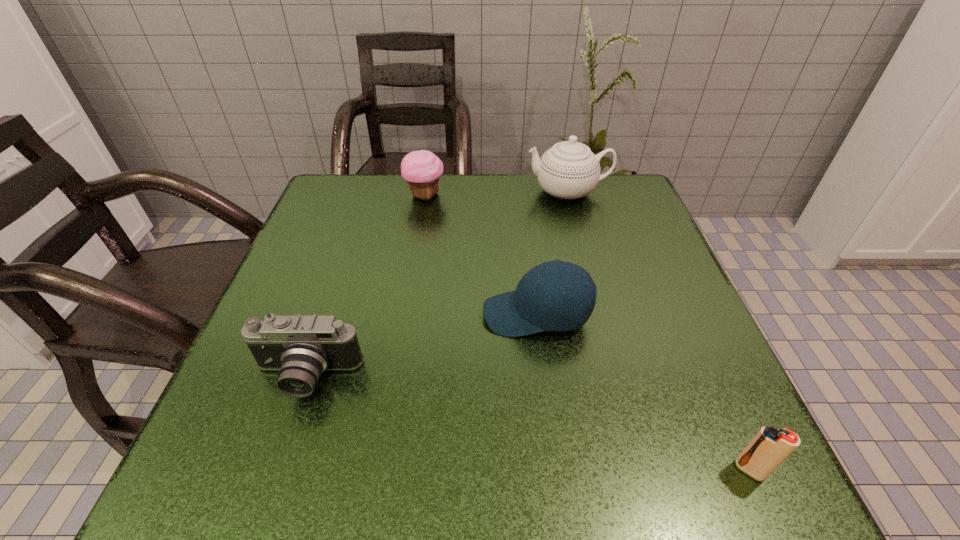
The height and width of the screenshot is (540, 960). Identify the location of chinaware at the right edge. (569, 170).

This screenshot has height=540, width=960. I want to click on igniter that is at the right edge, so click(770, 447).

You are a GUI agent. You are given a task and a screenshot of the screen. Output one action in this format:
    pyautogui.click(x=<x>, y=<y>)
    Task: Click on the object at the far right corner
    
    Given the screenshot: What is the action you would take?
    pyautogui.click(x=569, y=170)

Locate an element on the screen. object located at the near right corner is located at coordinates (770, 447).

This screenshot has height=540, width=960. In the image, there is a desktop. What are the coordinates of `vacant space at the far edge` in the screenshot? It's located at (492, 203).

Where is `vacant region at the near edge of the desktop`? The width and height of the screenshot is (960, 540). vacant region at the near edge of the desktop is located at coordinates tap(326, 497).

The width and height of the screenshot is (960, 540). Identify the location of vacant area at the left edge of the desktop. (359, 255).

The height and width of the screenshot is (540, 960). Identify the location of vacant space at the right edge. (655, 233).

In the image, there is a desktop. At what (x,y) coordinates should I click in order to perform the action: click on free space at the far left corner. Please return your answer as a coordinate pair (x, y). Looking at the image, I should click on click(x=347, y=181).

This screenshot has width=960, height=540. Identify the location of vacant space at the far right corner of the desktop. (633, 199).